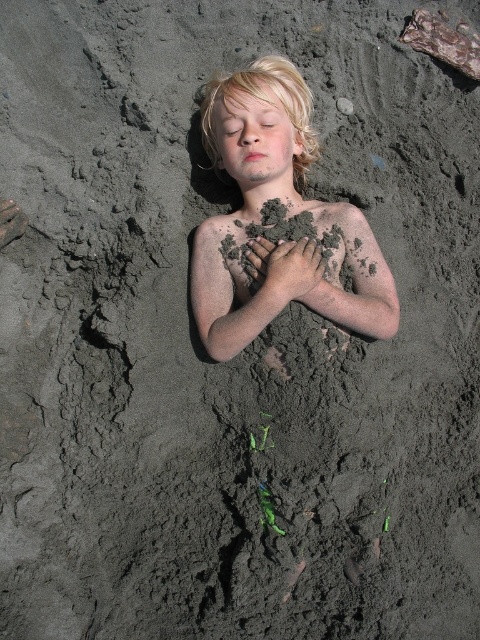
You are a photographer trying to capture the scene with the matte sand child at center and the dark brown mud hand at center. Based on their positions, which object should you focus on first if you want to ensure both are in the frame without moving the camera?

The matte sand child at center is positioned on the left side of dark brown mud hand at center, so you should focus on the matte sand child at center first to ensure both are in the frame without moving the camera.

You are a lifeguard at a beach and see the matte sand child at center and the dark brown mud hand at center. Which object is wider?

The matte sand child at center is wider than the dark brown mud hand at center.